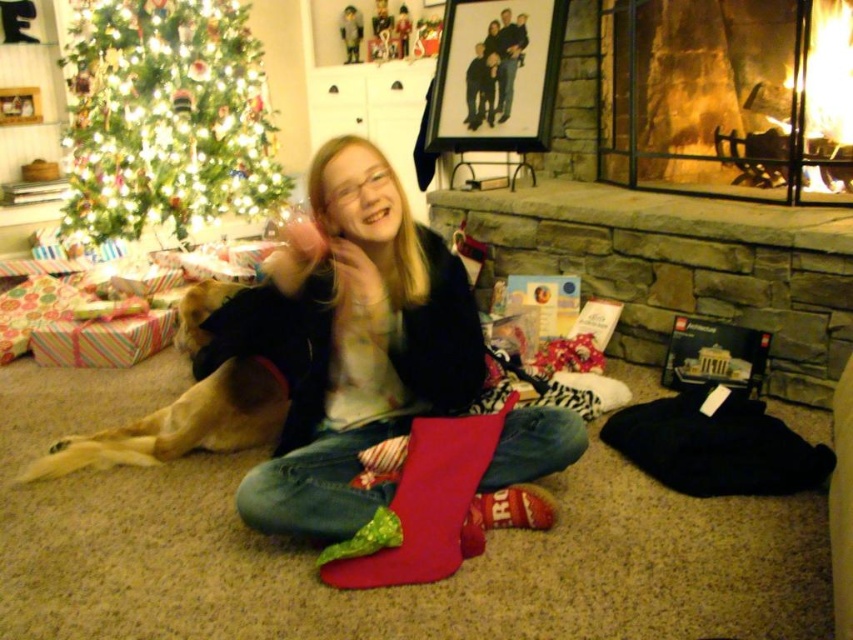
You are a delivery robot that needs to place a package between the matte red stocking at center and the green artificial christmas tree at upper left. The package requires 1.5 meters of space. Is there enough space between them?

The distance between the matte red stocking at center and the green artificial christmas tree at upper left is 1.88 meters, which is more than the required 1.5 meters. Therefore, there is enough space to place the package between them.

You are a child who wants to hang your new ornament on the green artificial christmas tree at upper left but first need to step over the matte red stocking at center. Based on their positions, which object should you move first to avoid tripping?

You should move the matte red stocking at center first because it is positioned to the right of the green artificial christmas tree at upper left, meaning it is in your path when approaching the tree.